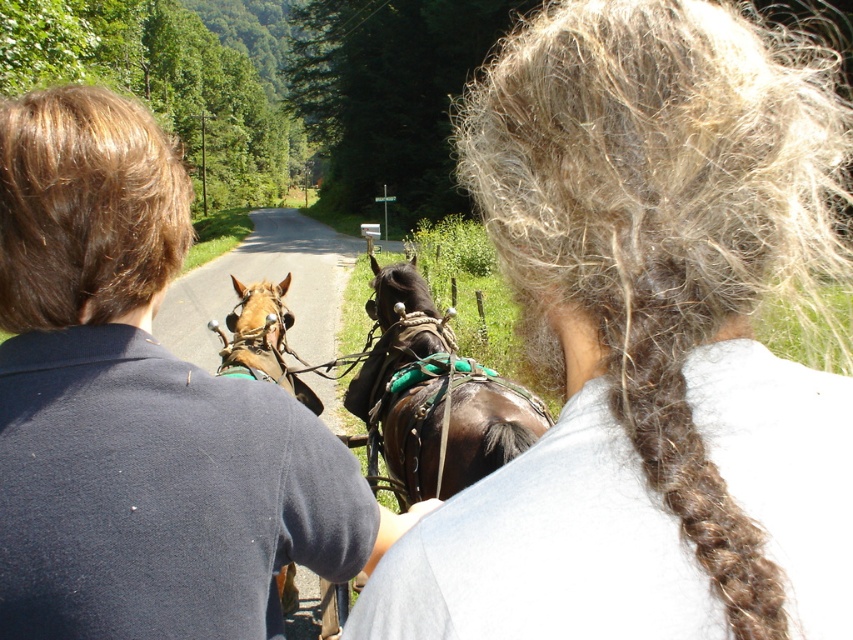
You are standing at the point labeled point (250, 308) and want to walk to the point labeled point (613, 410). Given that the road is straight and clear, which direction should you face to walk directly towards your destination?

You should face forward because point (613, 410) is in front of point (250, 308).

You are standing on the side of the road and see the brown fuzzy hair at upper center and the shiny brown horse at center. Which one is nearer to you?

The brown fuzzy hair at upper center is closer to the viewer than the shiny brown horse at center.

You are a photographer trying to capture a clear photo of the two subjects in the scene. The brown fuzzy hair at upper center and the shiny brown horse at center are both in your frame. Since you want to focus on the wider subject, which one should you adjust your camera to focus on?

The shiny brown horse at center is wider than the brown fuzzy hair at upper center, so you should focus on the shiny brown horse at center.